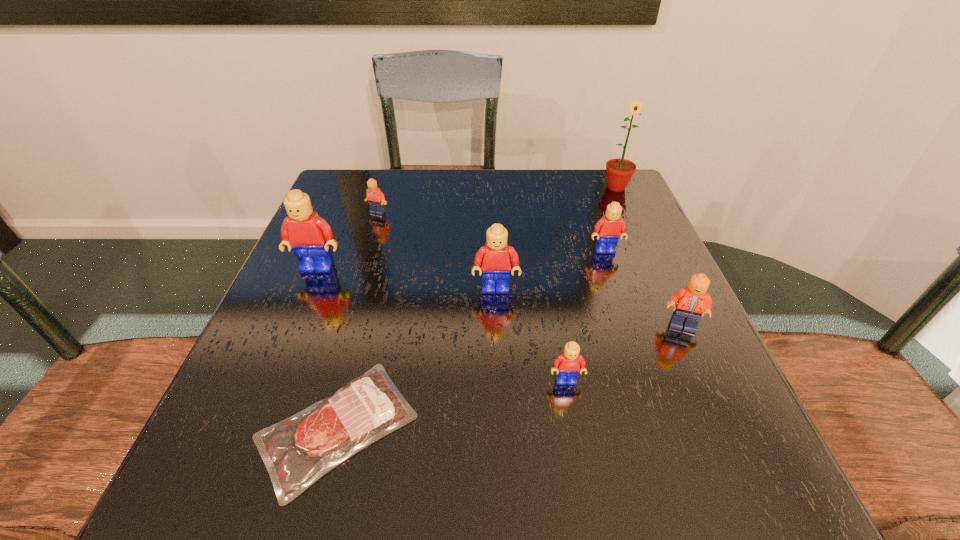
Image resolution: width=960 pixels, height=540 pixels. I want to click on object that is at the far right corner, so click(619, 170).

I want to click on free space at the far edge, so click(478, 190).

Find the location of `vacant space at the near edge of the desktop`. vacant space at the near edge of the desktop is located at coordinates (362, 487).

Locate an element on the screen. Image resolution: width=960 pixels, height=540 pixels. blank space at the left edge is located at coordinates click(x=331, y=225).

Find the location of a particular element. Image resolution: width=960 pixels, height=540 pixels. free space at the right edge of the desktop is located at coordinates (661, 369).

In the image, there is a desktop. At what (x,y) coordinates should I click in order to perform the action: click on free space at the far left corner. Please return your answer as a coordinate pair (x, y). Looking at the image, I should click on (357, 180).

This screenshot has width=960, height=540. What are the coordinates of `vacant area at the near left corner` in the screenshot? It's located at (191, 473).

Identify the location of vacant area between the smaller orange Lego and the farthest object. (497, 200).

The height and width of the screenshot is (540, 960). I want to click on vacant space that's between the farther orange Lego and the fifth object from right to left, so click(x=437, y=251).

Image resolution: width=960 pixels, height=540 pixels. What are the coordinates of `free spot between the farthest yellow Lego and the shortest object` in the screenshot? It's located at (471, 339).